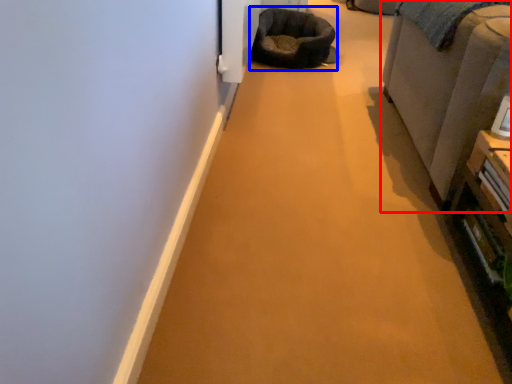
Question: Which object appears closest to the camera in this image, furniture (highlighted by a red box) or bean bag chair (highlighted by a blue box)?

Choices:
 (A) furniture
 (B) bean bag chair

Answer: (A)